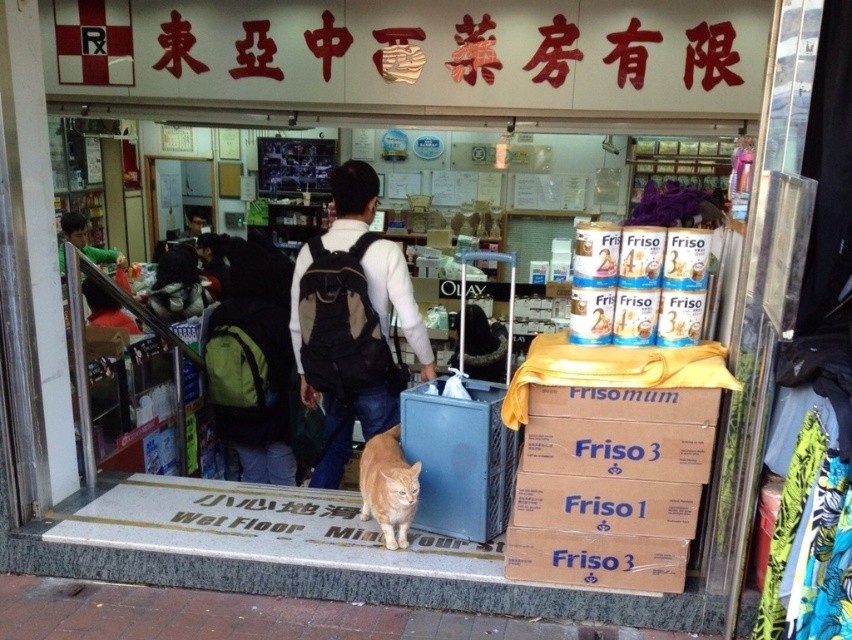
You are a customer entering the shop and see the brown cardboard box at right and the white paper sign at center. Which object is placed higher up?

The brown cardboard box at right is positioned over the white paper sign at center, so it is placed higher up.

You are standing outside the shop and want to place a new item on the brown cardboard box at right located at point (609, 486). Can you walk directly to that point from your current position?

The point (609, 486) is inside the shop where the brown cardboard box at right is located. Since you are outside, you need to enter the shop first before reaching that point.